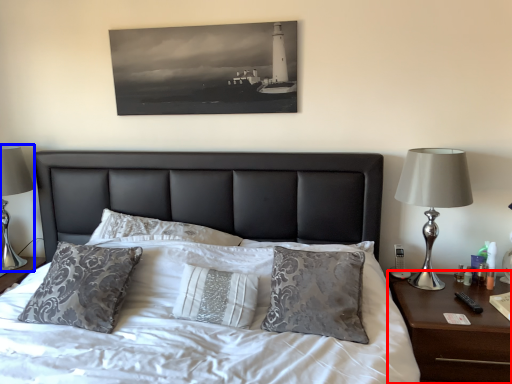
Question: Which object appears farthest to the camera in this image, nightstand (highlighted by a red box) or table lamp (highlighted by a blue box)?

Choices:
 (A) nightstand
 (B) table lamp

Answer: (B)